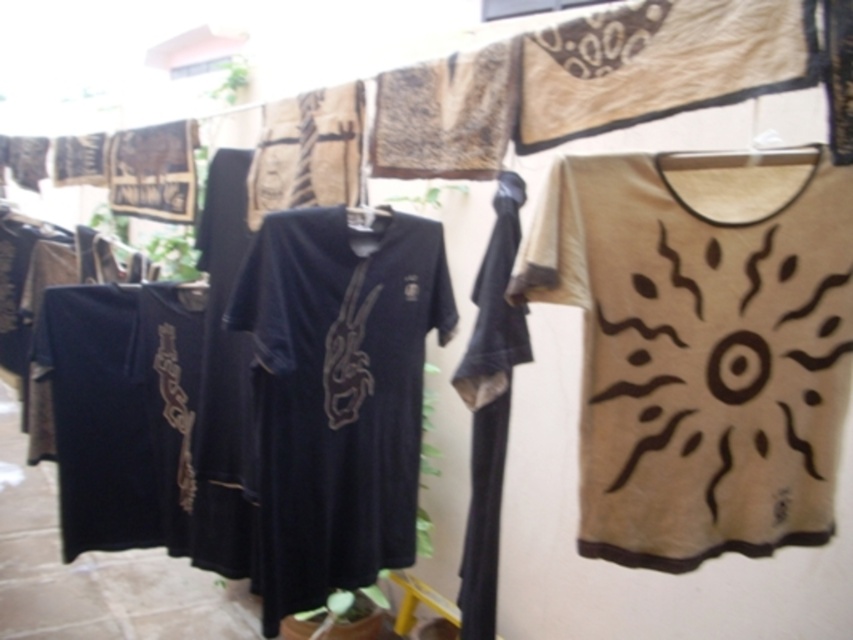
Can you confirm if beige cotton t-shirt at right is wider than matte black t-shirt at center?

Correct, the width of beige cotton t-shirt at right exceeds that of matte black t-shirt at center.

Who is more forward, (846, 180) or (404, 531)?

Point (846, 180)

Identify the location of beige cotton t-shirt at right. (698, 355).